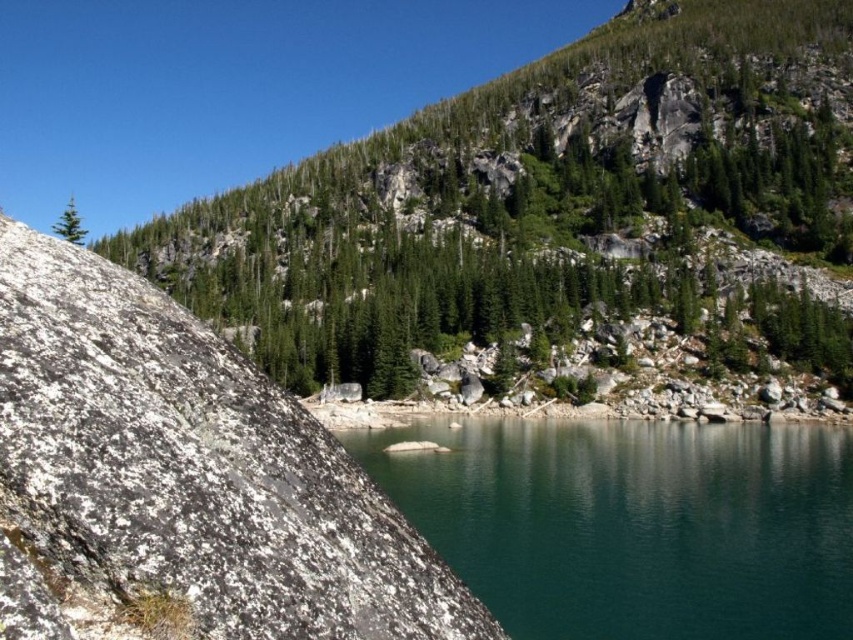
Describe the element at coordinates (556, 220) in the screenshot. The height and width of the screenshot is (640, 853). I see `green textured rock at center` at that location.

Does point (500, 106) lie in front of point (598, 484)?

No, it is behind (598, 484).

The height and width of the screenshot is (640, 853). In order to click on green textured rock at center in this screenshot , I will do `click(556, 220)`.

Where is `teal glassy water at center`? teal glassy water at center is located at coordinates (635, 524).

Who is more forward, (413, 493) or (73, 237)?

Point (413, 493) is in front.

Where is `teal glassy water at center`? teal glassy water at center is located at coordinates (635, 524).

This screenshot has height=640, width=853. I want to click on teal glassy water at center, so click(x=635, y=524).

Does point (393, 538) come farther from viewer compared to point (653, 589)?

No, (393, 538) is in front of (653, 589).

Which is more to the right, white speckled rock at center or teal glassy water at center?

From the viewer's perspective, teal glassy water at center appears more on the right side.

Identify the location of white speckled rock at center. Image resolution: width=853 pixels, height=640 pixels. (181, 480).